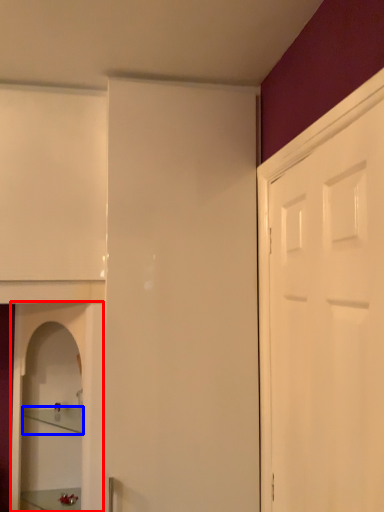
Question: Which of the following is the closest to the observer, cabinetry (highlighted by a red box) or shelf (highlighted by a blue box)?

Choices:
 (A) cabinetry
 (B) shelf

Answer: (A)